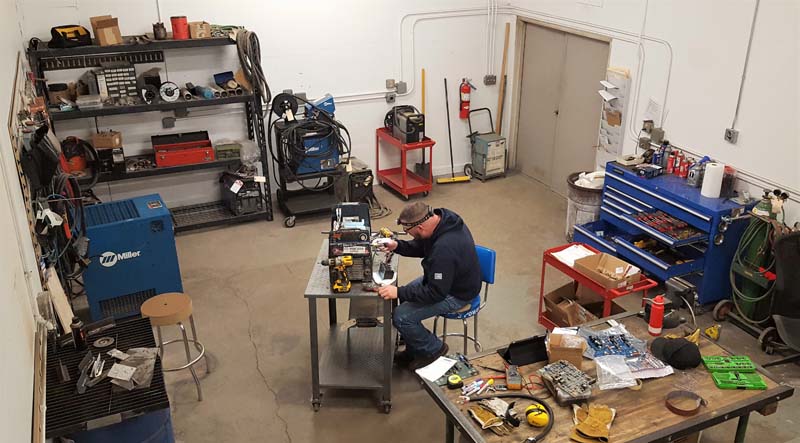
This screenshot has width=800, height=443. I want to click on wall, so click(x=692, y=60).